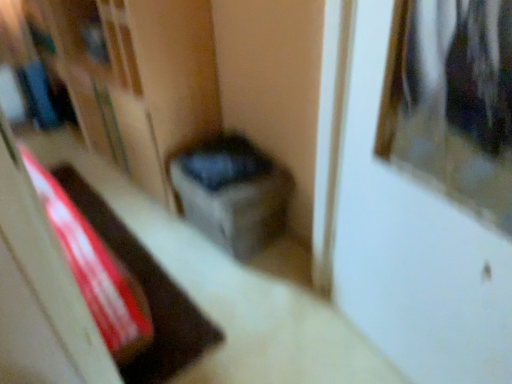
This screenshot has width=512, height=384. What do you see at coordinates (232, 193) in the screenshot?
I see `gray fabric bean bag chair at center` at bounding box center [232, 193].

The height and width of the screenshot is (384, 512). I want to click on gray fabric bean bag chair at center, so click(232, 193).

Measure the distance between gray fabric bean bag chair at center and camera.

The depth of gray fabric bean bag chair at center is 5.54 feet.

You are a GUI agent. You are given a task and a screenshot of the screen. Output one action in this format:
    pyautogui.click(x=<x>, y=<y>)
    Task: Click on the gray fabric bean bag chair at center
    Image resolution: width=512 pixels, height=384 pixels.
    Given the screenshot: What is the action you would take?
    pyautogui.click(x=232, y=193)